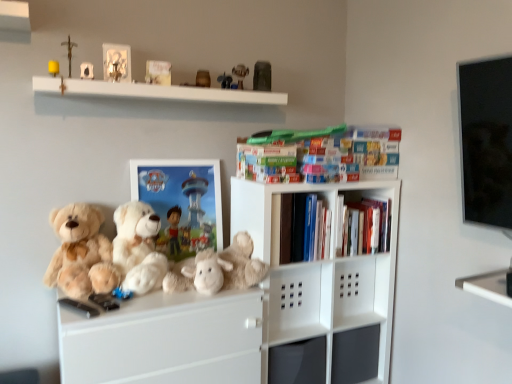
Question: Could metallic gray figurine at upper center, the 8th toy when ordered from left to right, be considered to be inside fluffy white teddy bear at center, the second teddy bear positioned from the left?

Choices:
 (A) no
 (B) yes

Answer: (A)

Question: Can you confirm if fluffy white teddy bear at center, which appears as the 1th teddy bear when viewed from the right, is thinner than metallic gray figurine at upper center, the first toy in the right-to-left sequence?

Choices:
 (A) yes
 (B) no

Answer: (B)

Question: Can you confirm if fluffy white teddy bear at center, the second teddy bear positioned from the left, is taller than metallic gray figurine at upper center, the first toy in the right-to-left sequence?

Choices:
 (A) yes
 (B) no

Answer: (A)

Question: Is fluffy white teddy bear at center, which appears as the 1th teddy bear when viewed from the right, positioned beyond the bounds of metallic gray figurine at upper center, the 8th toy when ordered from left to right?

Choices:
 (A) no
 (B) yes

Answer: (B)

Question: Is there a large distance between fluffy white teddy bear at center, the second teddy bear positioned from the left, and metallic gray figurine at upper center, the 8th toy when ordered from left to right?

Choices:
 (A) yes
 (B) no

Answer: (B)

Question: From the image's perspective, is plush toy at upper center, which is the second toy in right-to-left order, above or below hardcover books at center, arranged as the 3th book when viewed from the left?

Choices:
 (A) above
 (B) below

Answer: (A)

Question: From their relative heights in the image, would you say plush toy at upper center, placed as the seventh toy when sorted from left to right, is taller or shorter than hardcover books at center, the 1th book positioned from the right?

Choices:
 (A) tall
 (B) short

Answer: (B)

Question: Considering the positions of point (241, 66) and point (372, 205), is point (241, 66) closer or farther from the camera than point (372, 205)?

Choices:
 (A) closer
 (B) farther

Answer: (B)

Question: From a real-world perspective, is plush toy at upper center, which is the second toy in right-to-left order, positioned above or below hardcover books at center, which is the 3th book from top to bottom?

Choices:
 (A) below
 (B) above

Answer: (B)

Question: From a real-world perspective, relative to yellow matte candle at upper left, the 1th toy positioned from the left, is matte plastic toy at upper center, marked as the sixth toy in a left-to-right arrangement, vertically above or below?

Choices:
 (A) above
 (B) below

Answer: (A)

Question: Is matte plastic toy at upper center, which is the third toy in right-to-left order, inside or outside of yellow matte candle at upper left, the 8th toy viewed from the right?

Choices:
 (A) outside
 (B) inside

Answer: (A)

Question: Is matte plastic toy at upper center, which is the third toy in right-to-left order, in front of or behind yellow matte candle at upper left, the 1th toy positioned from the left, in the image?

Choices:
 (A) behind
 (B) front

Answer: (A)

Question: From the image's perspective, relative to yellow matte candle at upper left, the 1th toy positioned from the left, is matte plastic toy at upper center, which is the third toy in right-to-left order, above or below?

Choices:
 (A) above
 (B) below

Answer: (A)

Question: Considering the relative positions of matte plastic toy at upper center, which is the third toy in right-to-left order, and hardcover books at center, arranged as the 3th book when viewed from the left, in the image provided, is matte plastic toy at upper center, which is the third toy in right-to-left order, to the left or to the right of hardcover books at center, arranged as the 3th book when viewed from the left,?

Choices:
 (A) left
 (B) right

Answer: (A)

Question: From a real-world perspective, relative to hardcover books at center, which is the 3th book from top to bottom, is matte plastic toy at upper center, which is the third toy in right-to-left order, vertically above or below?

Choices:
 (A) below
 (B) above

Answer: (B)